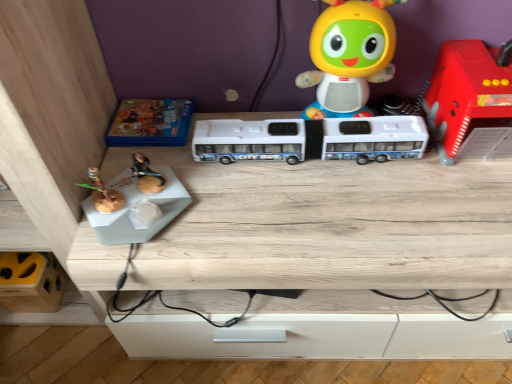
Find the location of `vacant space in front of white plastic bus at center, the 3th toy positioned from the left`. vacant space in front of white plastic bus at center, the 3th toy positioned from the left is located at coordinates (324, 211).